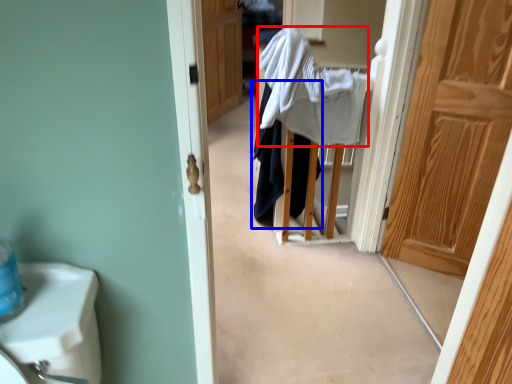
Question: Which object is further to the camera taking this photo, bath towel (highlighted by a red box) or clothing (highlighted by a blue box)?

Choices:
 (A) bath towel
 (B) clothing

Answer: (B)